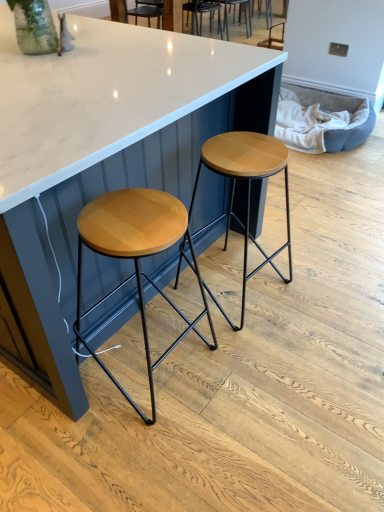
Find the location of a particular element. white glossy table at center is located at coordinates (105, 149).

Where is `wooden seat at center, which is the 2th chair in front-to-back order`? Image resolution: width=384 pixels, height=512 pixels. wooden seat at center, which is the 2th chair in front-to-back order is located at coordinates (239, 15).

What do you see at coordinates (239, 15) in the screenshot? I see `wooden seat at center, which appears as the 2th chair when viewed from the left` at bounding box center [239, 15].

What do you see at coordinates (201, 13) in the screenshot? I see `wooden seat at center, positioned as the second chair in right-to-left order` at bounding box center [201, 13].

The image size is (384, 512). Identify the location of woodenmaterial/texturestool at left, which appears as the 2th stool when viewed from the right. (136, 256).

This screenshot has height=512, width=384. What do you see at coordinates (247, 188) in the screenshot? I see `wooden matte stool at center, which is the 2th stool in left-to-right order` at bounding box center [247, 188].

The width and height of the screenshot is (384, 512). What are the coordinates of `wooden matte stool at center, the first stool viewed from the right` in the screenshot? It's located at (247, 188).

Identify the location of white glossy table at center. (105, 149).

Is wooden matte stool at center, the first stool viewed from the right, facing towards woodenmaterial/texturestool at left, which appears as the 2th stool when viewed from the right?

No, wooden matte stool at center, the first stool viewed from the right, is not oriented towards woodenmaterial/texturestool at left, which appears as the 2th stool when viewed from the right.

Does wooden matte stool at center, which is the 2th stool in left-to-right order, have a greater height compared to woodenmaterial/texturestool at left, arranged as the first stool when viewed from the left?

Incorrect, the height of wooden matte stool at center, which is the 2th stool in left-to-right order, is not larger of that of woodenmaterial/texturestool at left, arranged as the first stool when viewed from the left.

Is wooden matte stool at center, which is the 2th stool in left-to-right order, surrounding woodenmaterial/texturestool at left, arranged as the first stool when viewed from the left?

Actually, woodenmaterial/texturestool at left, arranged as the first stool when viewed from the left, is outside wooden matte stool at center, which is the 2th stool in left-to-right order.

Is wooden matte stool at center, which is the 2th stool in left-to-right order, to the left of woodenmaterial/texturestool at left, arranged as the first stool when viewed from the left, from the viewer's perspective?

No, wooden matte stool at center, which is the 2th stool in left-to-right order, is not to the left of woodenmaterial/texturestool at left, arranged as the first stool when viewed from the left.

Which is correct: wooden seat at center, the second chair positioned from the back, is inside wooden matte stool at center, the first stool viewed from the right, or outside of it?

wooden seat at center, the second chair positioned from the back, lies outside wooden matte stool at center, the first stool viewed from the right.

Is wooden seat at center, the second chair positioned from the back, looking in the opposite direction of wooden matte stool at center, the first stool viewed from the right?

No, wooden seat at center, the second chair positioned from the back, is not facing away from wooden matte stool at center, the first stool viewed from the right.

Does wooden seat at center, the second chair positioned from the back, have a lesser height compared to wooden matte stool at center, which is the 2th stool in left-to-right order?

Yes, wooden seat at center, the second chair positioned from the back, is shorter than wooden matte stool at center, which is the 2th stool in left-to-right order.

From a real-world perspective, is white glossy table at center on top of wooden seat at center, the second chair positioned from the back?

Yes, from a real-world perspective, white glossy table at center is over wooden seat at center, the second chair positioned from the back

Between white glossy table at center and wooden seat at center, the second chair positioned from the back, which one has smaller size?

wooden seat at center, the second chair positioned from the back, is smaller.

Is white glossy table at center shorter than wooden seat at center, which is the first chair in left-to-right order?

No, white glossy table at center is not shorter than wooden seat at center, which is the first chair in left-to-right order.

Where is `table in front of the wooden seat at center, the second chair positioned from the back`? table in front of the wooden seat at center, the second chair positioned from the back is located at coordinates coord(105,149).

Are woodenmaterial/texturestool at left, arranged as the first stool when viewed from the left, and wooden seat at center, which is the first chair in left-to-right order, far apart?

Yes, woodenmaterial/texturestool at left, arranged as the first stool when viewed from the left, is far from wooden seat at center, which is the first chair in left-to-right order.

From a real-world perspective, starting from the wooden seat at center, positioned as the second chair in right-to-left order, which stool is the 1st one vertically above it? Please provide its 2D coordinates.

[(136, 256)]

Could wooden matte stool at center, which is the 2th stool in left-to-right order, be considered to be inside wooden seat at center, which appears as the 2th chair when viewed from the left?

No, wooden seat at center, which appears as the 2th chair when viewed from the left, does not contain wooden matte stool at center, which is the 2th stool in left-to-right order.

How much distance is there between wooden seat at center, which appears as the 2th chair when viewed from the left, and wooden matte stool at center, the first stool viewed from the right?

wooden seat at center, which appears as the 2th chair when viewed from the left, is 2.24 meters away from wooden matte stool at center, the first stool viewed from the right.

Between wooden seat at center, which appears as the 2th chair when viewed from the left, and wooden matte stool at center, the first stool viewed from the right, which one appears on the left side from the viewer's perspective?

wooden matte stool at center, the first stool viewed from the right, is more to the left.

Is point (244, 0) closer to camera compared to point (143, 213)?

That is False.

Who is shorter, wooden seat at center, which appears as the 2th chair when viewed from the left, or woodenmaterial/texturestool at left, arranged as the first stool when viewed from the left?

wooden seat at center, which appears as the 2th chair when viewed from the left, is shorter.

From the image's perspective, which one is positioned higher, wooden seat at center, which ranks as the first chair in right-to-left order, or woodenmaterial/texturestool at left, which appears as the 2th stool when viewed from the right?

wooden seat at center, which ranks as the first chair in right-to-left order, from the image's perspective.

Based on their sizes in the image, would you say wooden seat at center, positioned as the second chair in right-to-left order, is bigger or smaller than white glossy table at center?

In the image, wooden seat at center, positioned as the second chair in right-to-left order, appears to be smaller than white glossy table at center.

In the scene shown: Which object is wider, wooden seat at center, which is the first chair in left-to-right order, or white glossy table at center?

white glossy table at center.

Which object is closer to the camera taking this photo, wooden seat at center, the first chair viewed from the front, or white glossy table at center?

white glossy table at center is closer to the camera.

Identify the location of table that appears in front of the wooden seat at center, positioned as the second chair in right-to-left order. (105, 149).

Identify the location of stool on the left side of wooden matte stool at center, which is the 2th stool in left-to-right order. The height and width of the screenshot is (512, 384). (136, 256).

Locate an element on the screen. This screenshot has height=512, width=384. the 1st stool positioned below the wooden seat at center, the first chair viewed from the front (from the image's perspective) is located at coordinates (247, 188).

Estimate the real-world distances between objects in this image. Which object is further from wooden seat at center, which ranks as the first chair in right-to-left order, wooden matte stool at center, which is the 2th stool in left-to-right order, or wooden seat at center, positioned as the second chair in right-to-left order?

Among the two, wooden matte stool at center, which is the 2th stool in left-to-right order, is located further to wooden seat at center, which ranks as the first chair in right-to-left order.

From the image, which object appears to be nearer to white glossy table at center, wooden seat at center, positioned as the second chair in right-to-left order, or wooden seat at center, which appears as the 2th chair when viewed from the left?

wooden seat at center, positioned as the second chair in right-to-left order, is positioned closer to the anchor white glossy table at center.

In the scene shown: When comparing their distances from woodenmaterial/texturestool at left, which appears as the 2th stool when viewed from the right, does wooden seat at center, which ranks as the first chair in right-to-left order, or white glossy table at center seem further?

wooden seat at center, which ranks as the first chair in right-to-left order, is further to woodenmaterial/texturestool at left, which appears as the 2th stool when viewed from the right.

Based on their spatial positions, is wooden matte stool at center, which is the 2th stool in left-to-right order, or white glossy table at center closer to wooden seat at center, which is the 2th chair in front-to-back order?

The object closer to wooden seat at center, which is the 2th chair in front-to-back order, is wooden matte stool at center, which is the 2th stool in left-to-right order.

Estimate the real-world distances between objects in this image. Which object is further from woodenmaterial/texturestool at left, arranged as the first stool when viewed from the left, wooden matte stool at center, which is the 2th stool in left-to-right order, or white glossy table at center?

wooden matte stool at center, which is the 2th stool in left-to-right order.

Which object lies further to the anchor point wooden seat at center, which ranks as the first chair in right-to-left order, wooden seat at center, the second chair positioned from the back, or white glossy table at center?

Among the two, white glossy table at center is located further to wooden seat at center, which ranks as the first chair in right-to-left order.

When comparing their distances from white glossy table at center, does wooden seat at center, which appears as the 2th chair when viewed from the left, or wooden matte stool at center, the first stool viewed from the right, seem further?

The object further to white glossy table at center is wooden seat at center, which appears as the 2th chair when viewed from the left.

Estimate the real-world distances between objects in this image. Which object is further from wooden matte stool at center, which is the 2th stool in left-to-right order, wooden seat at center, which is the first chair in left-to-right order, or white glossy table at center?

wooden seat at center, which is the first chair in left-to-right order, is positioned further to the anchor wooden matte stool at center, which is the 2th stool in left-to-right order.

Find the location of a particular element. The height and width of the screenshot is (512, 384). chair between white glossy table at center and wooden seat at center, which ranks as the first chair in right-to-left order, from front to back is located at coordinates (201, 13).

Image resolution: width=384 pixels, height=512 pixels. I want to click on stool positioned between woodenmaterial/texturestool at left, which appears as the 2th stool when viewed from the right, and wooden seat at center, which is the first chair in left-to-right order, from near to far, so click(247, 188).

You are a GUI agent. You are given a task and a screenshot of the screen. Output one action in this format:
    pyautogui.click(x=<x>, y=<y>)
    Task: Click on the chair between wooden matte stool at center, which is the 2th stool in left-to-right order, and wooden seat at center, which is the 2th chair in front-to-back order, in the front-back direction
    
    Given the screenshot: What is the action you would take?
    pyautogui.click(x=201, y=13)

Where is `stool between white glossy table at center and wooden matte stool at center, which is the 2th stool in left-to-right order, from left to right`? stool between white glossy table at center and wooden matte stool at center, which is the 2th stool in left-to-right order, from left to right is located at coordinates (136, 256).